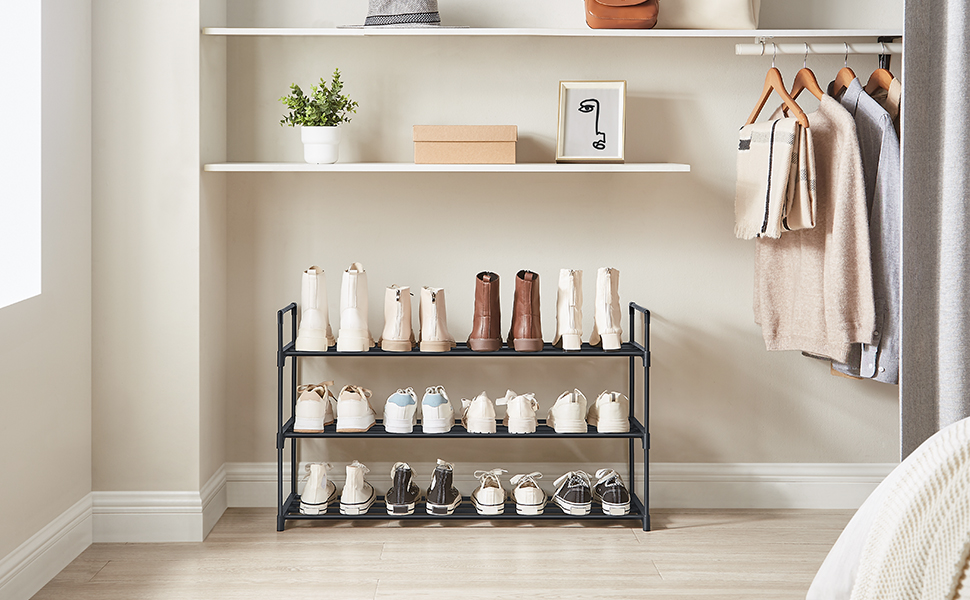
Locate an element on the screen. This screenshot has width=970, height=600. wooden hanger is located at coordinates (883, 78), (845, 76), (805, 78), (773, 79).